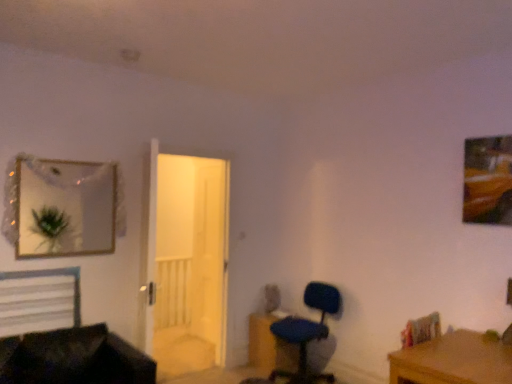
Question: Is wooden frame at upper right bigger or smaller than black leather couch at lower left?

Choices:
 (A) small
 (B) big

Answer: (A)

Question: Is wooden frame at upper right taller or shorter than black leather couch at lower left?

Choices:
 (A) tall
 (B) short

Answer: (A)

Question: Considering the real-world distances, which object is farthest from the blue fabric chair at lower right?

Choices:
 (A) matte silver mirror at upper left
 (B) white wooden door at center
 (C) brown wooden desk at lower right
 (D) white matte bed at lower left
 (E) wooden frame at upper right

Answer: (A)

Question: Which of these objects is positioned farthest from the blue fabric chair at lower right?

Choices:
 (A) matte silver mirror at upper left
 (B) wooden frame at upper right
 (C) brown wooden desk at lower right
 (D) black leather couch at lower left
 (E) white matte bed at lower left

Answer: (A)